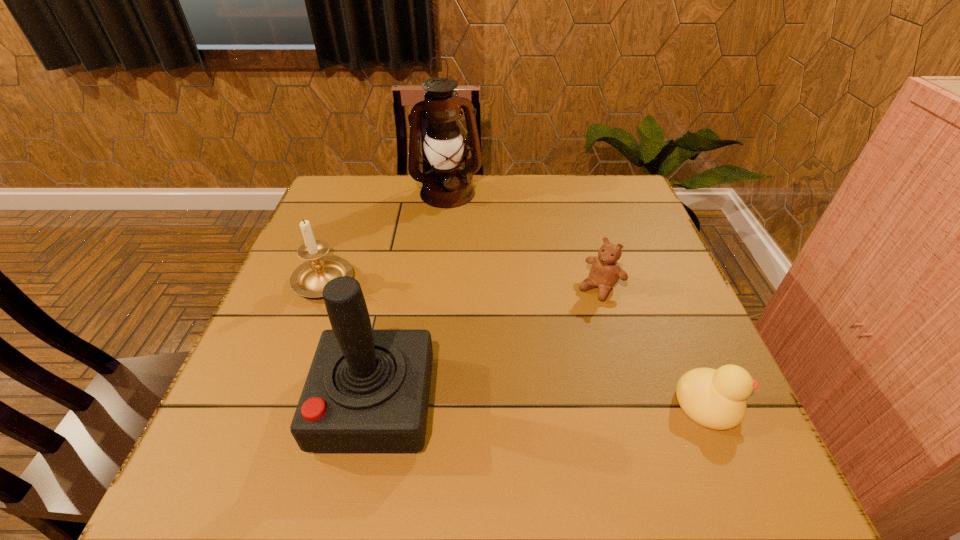
You are a GUI agent. You are given a task and a screenshot of the screen. Output one action in this format:
    pyautogui.click(x=<x>, y=<y>)
    Task: Click on the free space at the far left corner of the desktop
    
    Given the screenshot: What is the action you would take?
    pyautogui.click(x=382, y=175)

Identify the location of free spot between the third shortest object and the rightmost object. The height and width of the screenshot is (540, 960). click(516, 342).

This screenshot has width=960, height=540. What are the coordinates of `free space that is in between the candle holder and the farthest object` in the screenshot? It's located at (386, 237).

Identify the location of vacant space that's between the shortest object and the fourth object from left to right. This screenshot has height=540, width=960. (654, 346).

Find the location of a particular element. The width and height of the screenshot is (960, 540). free space between the joystick and the duckling is located at coordinates (541, 403).

At what (x,y) coordinates should I click in order to perform the action: click on free space between the shortest object and the second tallest object. Please return your answer as a coordinate pair (x, y). Looking at the image, I should click on (541, 403).

Where is `free spot between the rightmost object and the lantern`? The height and width of the screenshot is (540, 960). free spot between the rightmost object and the lantern is located at coordinates (578, 298).

Find the location of a particular element. vacant region between the shortest object and the fourth object from left to right is located at coordinates (654, 346).

Where is `vacant space in between the teddy bear and the joystick`? This screenshot has width=960, height=540. vacant space in between the teddy bear and the joystick is located at coordinates (487, 345).

Locate which object is the third closest to the teddy bear. Please provide its 2D coordinates. Your answer should be formatted as a tuple, i.e. [(x, y)], where the tuple contains the x and y coordinates of a point satisfying the conditions above.

[(367, 390)]